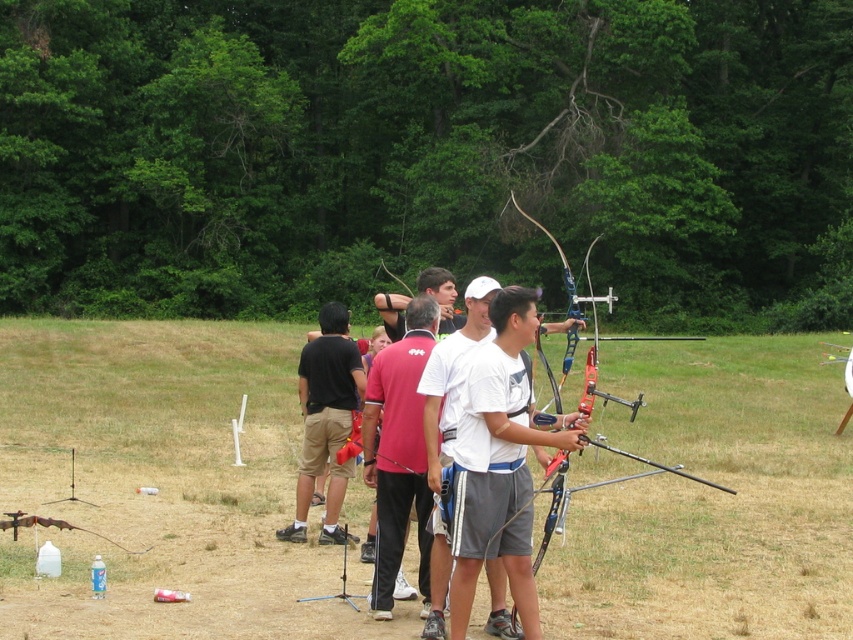
Question: Can you confirm if white matte shirt at center is bigger than matte blue bow at center?

Choices:
 (A) no
 (B) yes

Answer: (A)

Question: Where is grassy field at center located in relation to matte blue bow at center in the image?

Choices:
 (A) above
 (B) below

Answer: (B)

Question: In this image, where is white matte shirt at center located relative to matte black shirt at center?

Choices:
 (A) left
 (B) right

Answer: (B)

Question: Which point is closer to the camera?

Choices:
 (A) grassy field at center
 (B) matte blue bow at center
 (C) matte black shirt at center
 (D) white matte shirt at center

Answer: (B)

Question: Which is nearer to the matte black shirt at center?

Choices:
 (A) grassy field at center
 (B) matte blue bow at center

Answer: (B)

Question: Which point is farther to the camera?

Choices:
 (A) [x=798, y=525]
 (B) [x=479, y=557]
 (C) [x=540, y=227]
 (D) [x=331, y=301]

Answer: (D)